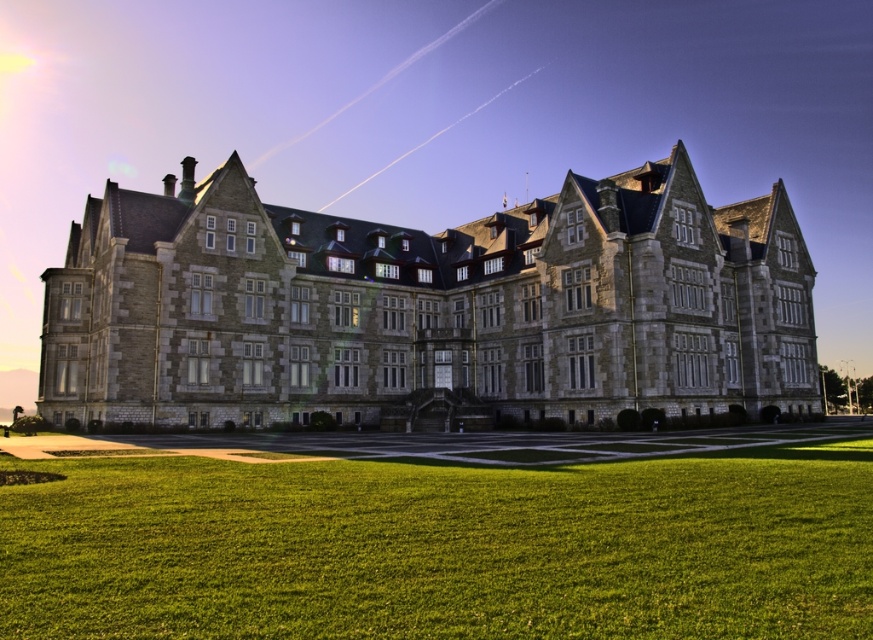
Question: Can you confirm if stone mansion at center is smaller than green grass at lower center?

Choices:
 (A) yes
 (B) no

Answer: (B)

Question: Can you confirm if stone mansion at center is positioned to the left of green grass at lower center?

Choices:
 (A) yes
 (B) no

Answer: (A)

Question: Which of the following is the farthest from the observer?

Choices:
 (A) stone mansion at center
 (B) green grass at lower center

Answer: (A)

Question: Can you confirm if stone mansion at center is smaller than green grass at lower center?

Choices:
 (A) no
 (B) yes

Answer: (A)